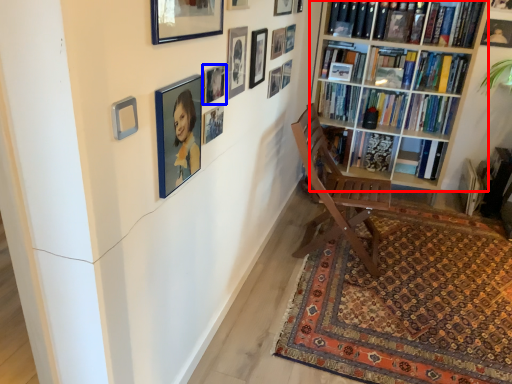
Question: Which object is further to the camera taking this photo, bookcase (highlighted by a red box) or picture frame (highlighted by a blue box)?

Choices:
 (A) bookcase
 (B) picture frame

Answer: (A)